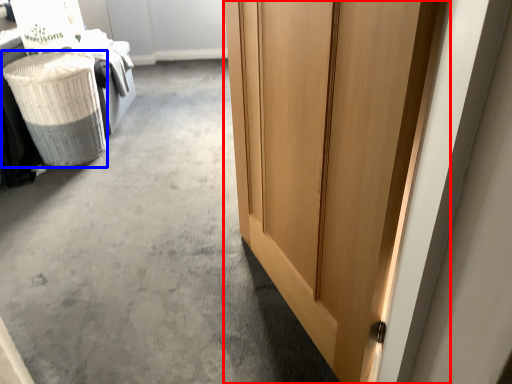
Question: Which of the following is the closest to the observer, door (highlighted by a red box) or laundry basket (highlighted by a blue box)?

Choices:
 (A) door
 (B) laundry basket

Answer: (A)